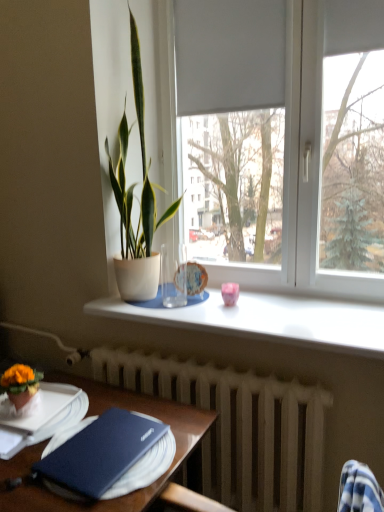
Question: From the image's perspective, is pink glossy cup at center, which ranks as the first tableware in right-to-left order, beneath orange felt flower pot at lower left, the second houseplant in the back-to-front sequence?

Choices:
 (A) no
 (B) yes

Answer: (A)

Question: Can you confirm if pink glossy cup at center, the 1th tableware from the front, is positioned to the left of orange felt flower pot at lower left, the 2th houseplant positioned from the top?

Choices:
 (A) no
 (B) yes

Answer: (A)

Question: Does pink glossy cup at center, the 1th tableware from the front, have a larger size compared to orange felt flower pot at lower left, arranged as the first houseplant when viewed from the front?

Choices:
 (A) yes
 (B) no

Answer: (B)

Question: Could you tell me if pink glossy cup at center, the 1th tableware from the front, is turned towards orange felt flower pot at lower left, placed as the second houseplant when sorted from right to left?

Choices:
 (A) no
 (B) yes

Answer: (A)

Question: Is pink glossy cup at center, the second tableware from the left, further to camera compared to orange felt flower pot at lower left, the 1th houseplant in the left-to-right sequence?

Choices:
 (A) no
 (B) yes

Answer: (B)

Question: Is wooden table at lower left to the left or to the right of white smooth window sill at center in the image?

Choices:
 (A) left
 (B) right

Answer: (A)

Question: From the image's perspective, relative to white smooth window sill at center, is wooden table at lower left above or below?

Choices:
 (A) above
 (B) below

Answer: (B)

Question: From a real-world perspective, is wooden table at lower left positioned above or below white smooth window sill at center?

Choices:
 (A) below
 (B) above

Answer: (A)

Question: Does point (117, 391) appear closer or farther from the camera than point (233, 327)?

Choices:
 (A) closer
 (B) farther

Answer: (B)

Question: Does point (34, 504) appear closer or farther from the camera than point (117, 170)?

Choices:
 (A) closer
 (B) farther

Answer: (A)

Question: In the image, is wooden table at lower left positioned in front of or behind matte white pot at center, the second houseplant from the front?

Choices:
 (A) behind
 (B) front

Answer: (B)

Question: From a real-world perspective, is wooden table at lower left positioned above or below matte white pot at center, which is the 1th houseplant in right-to-left order?

Choices:
 (A) below
 (B) above

Answer: (A)

Question: Based on their sizes in the image, would you say wooden table at lower left is bigger or smaller than matte white pot at center, the second houseplant from the front?

Choices:
 (A) small
 (B) big

Answer: (B)

Question: Is point (175, 275) closer or farther from the camera than point (13, 390)?

Choices:
 (A) closer
 (B) farther

Answer: (B)

Question: Considering the positions of porcelain plate at center, which is the first tableware in left-to-right order, and orange felt flower pot at lower left, the 1th houseplant in the left-to-right sequence, in the image, is porcelain plate at center, which is the first tableware in left-to-right order, bigger or smaller than orange felt flower pot at lower left, the 1th houseplant in the left-to-right sequence,?

Choices:
 (A) big
 (B) small

Answer: (B)